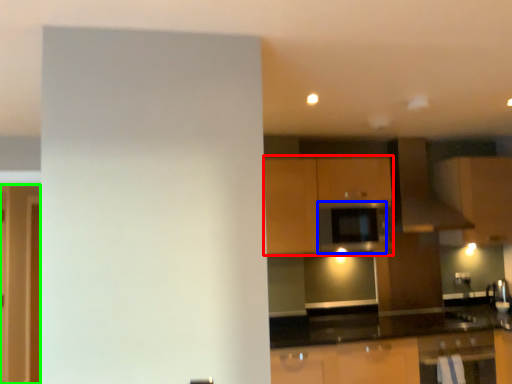
Question: Which object is the farthest from cabinetry (highlighted by a red box)? Choose among these: appliance (highlighted by a blue box) or glass door (highlighted by a green box).

Choices:
 (A) appliance
 (B) glass door

Answer: (B)